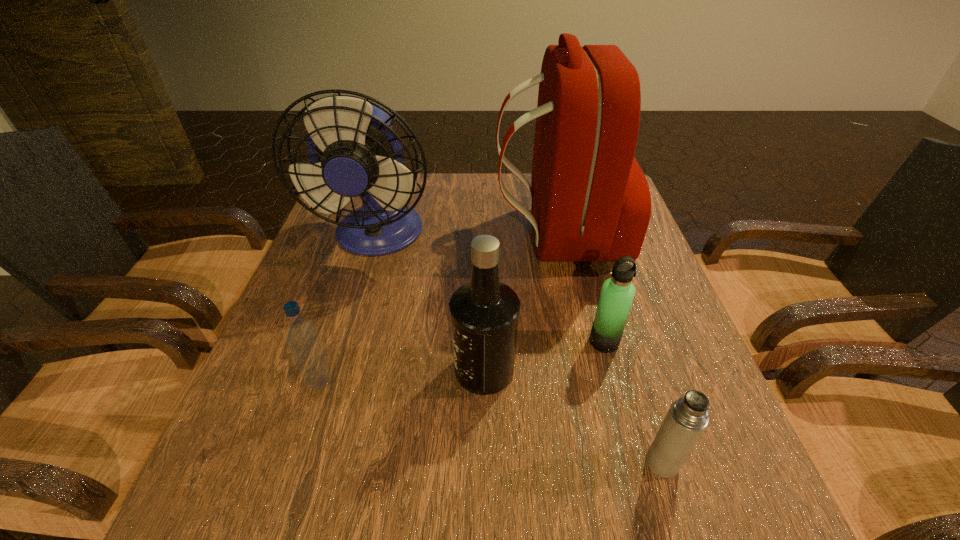
Locate an element on the screen. This screenshot has height=540, width=960. vacant space that is in between the liquor and the fan is located at coordinates (431, 303).

What are the coordinates of `free space that is in between the farther thermos bottle and the liquor` in the screenshot? It's located at (544, 355).

This screenshot has width=960, height=540. I want to click on unoccupied position between the backpack and the farther thermos bottle, so click(581, 289).

Locate an element on the screen. Image resolution: width=960 pixels, height=540 pixels. free space between the third tallest object and the nearest object is located at coordinates (573, 416).

This screenshot has width=960, height=540. In order to click on free space between the nearest object and the taller thermos bottle in this screenshot , I will do `click(634, 402)`.

Locate an element on the screen. free space between the fan and the fourth shortest object is located at coordinates (431, 303).

The height and width of the screenshot is (540, 960). In order to click on object identified as the fifth closest to the water bottle in this screenshot , I will do `click(687, 418)`.

You are a GUI agent. You are given a task and a screenshot of the screen. Output one action in this format:
    pyautogui.click(x=<x>, y=<y>)
    Task: Click on the object that is the fourth closest to the liquor
    Image resolution: width=960 pixels, height=540 pixels.
    Given the screenshot: What is the action you would take?
    pyautogui.click(x=687, y=418)

Locate an element on the screen. The height and width of the screenshot is (540, 960). free spot that satisfies the following two spatial constraints: 1. on the front label of the third tallest object; 2. on the back side of the nearer thermos bottle is located at coordinates (485, 463).

Find the location of a particular element. free location that satisfies the following two spatial constraints: 1. on the front label of the liquor; 2. on the left side of the shorter thermos bottle is located at coordinates (485, 463).